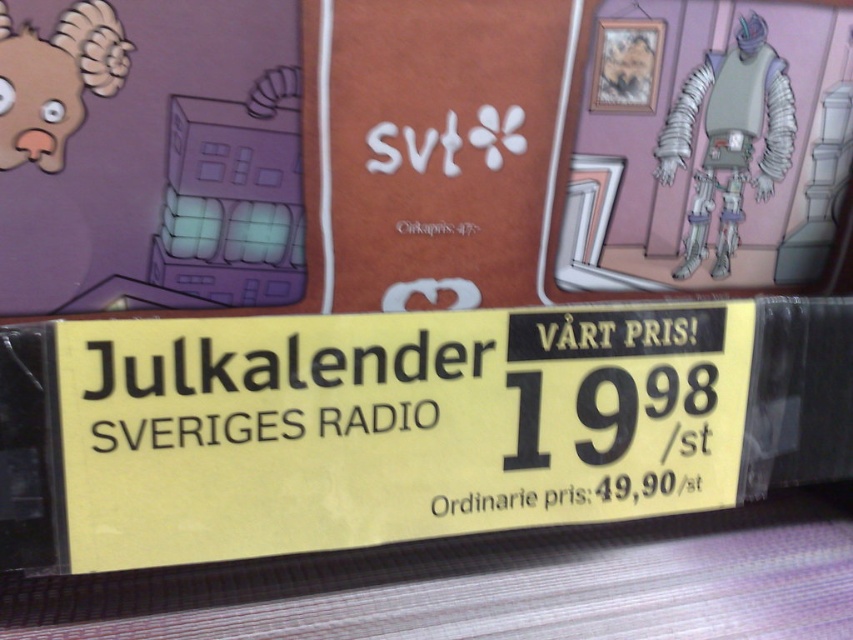
Is yellow paper sign at center above brown matte animal head at upper left?

No, yellow paper sign at center is not above brown matte animal head at upper left.

Between point (674, 355) and point (93, 81), which one is positioned in front?

Point (93, 81)

Measure the distance between yellow paper sign at center and camera.

yellow paper sign at center is 35.37 inches from camera.

You are a GUI agent. You are given a task and a screenshot of the screen. Output one action in this format:
    pyautogui.click(x=<x>, y=<y>)
    Task: Click on the yellow paper sign at center
    This screenshot has height=640, width=853.
    Given the screenshot: What is the action you would take?
    pyautogui.click(x=390, y=426)

Which is behind, point (380, 532) or point (709, 156)?

The point (709, 156) is behind.

Which of these two, yellow paper sign at center or gray metallic robot at upper right, stands taller?

Standing taller between the two is gray metallic robot at upper right.

Between point (154, 403) and point (682, 120), which one is positioned behind?

The point (682, 120) is behind.

The width and height of the screenshot is (853, 640). In order to click on yellow paper sign at center in this screenshot , I will do `click(390, 426)`.

Which is behind, point (712, 129) or point (67, 84)?

Positioned behind is point (712, 129).

Who is taller, gray metallic robot at upper right or brown matte animal head at upper left?

With more height is gray metallic robot at upper right.

Locate an element on the screen. gray metallic robot at upper right is located at coordinates (729, 138).